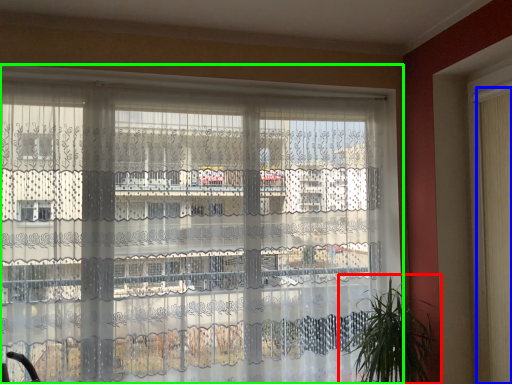
Question: Which object is the farthest from houseplant (highlighted by a red box)? Choose among these: shutter (highlighted by a blue box) or window (highlighted by a green box).

Choices:
 (A) shutter
 (B) window

Answer: (B)